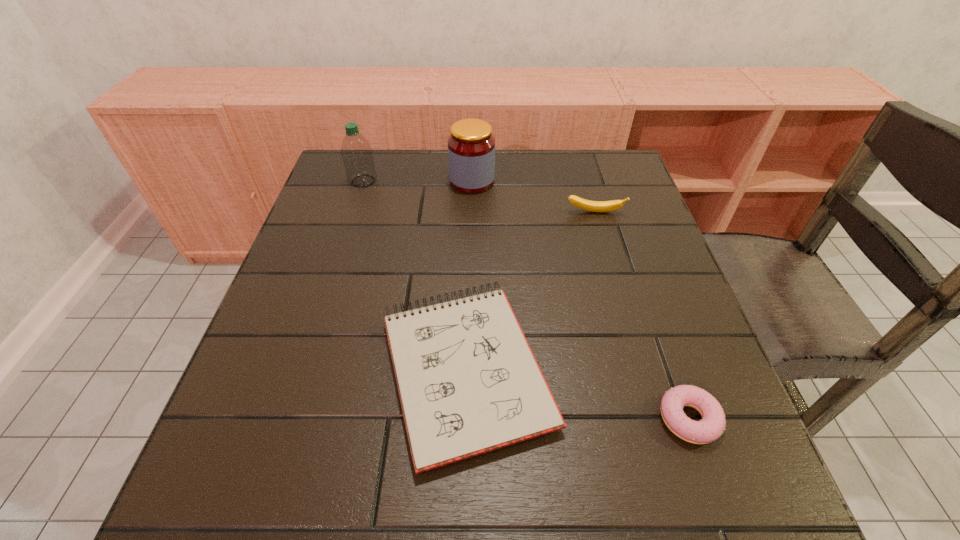
You are a GUI agent. You are given a task and a screenshot of the screen. Output one action in this format:
    pyautogui.click(x=<x>, y=<y>)
    Task: Click on the blank region between the water bottle and the jar
    Image resolution: width=960 pixels, height=540 pixels.
    Given the screenshot: What is the action you would take?
    pyautogui.click(x=418, y=181)

The height and width of the screenshot is (540, 960). What are the coordinates of `vacant region between the banana and the notepad` in the screenshot? It's located at [531, 291].

Select which object is the closest to the doughnut. Please provide its 2D coordinates. Your answer should be formatted as a tuple, i.e. [(x, y)], where the tuple contains the x and y coordinates of a point satisfying the conditions above.

[(468, 382)]

Where is `the third closest object relative to the doughnut`? the third closest object relative to the doughnut is located at coordinates (471, 146).

This screenshot has height=540, width=960. Identify the location of free region that satisfies the following two spatial constraints: 1. at the stem of the banana; 2. on the right side of the doughnut. (656, 418).

Identify the location of free space in the image that satisfies the following two spatial constraints: 1. on the front side of the doughnut; 2. on the left side of the jar. (467, 418).

At what (x,y) coordinates should I click in order to perform the action: click on free spot that satisfies the following two spatial constraints: 1. at the stem of the third farthest object; 2. on the right side of the doughnut. Please return your answer as a coordinate pair (x, y). The width and height of the screenshot is (960, 540). Looking at the image, I should click on (656, 418).

The image size is (960, 540). In order to click on vacant space that satisfies the following two spatial constraints: 1. on the front side of the doughnut; 2. on the left side of the jar in this screenshot , I will do coord(467,418).

Locate an element on the screen. The image size is (960, 540). free space that satisfies the following two spatial constraints: 1. on the front side of the notepad; 2. on the right side of the water bottle is located at coordinates (302, 369).